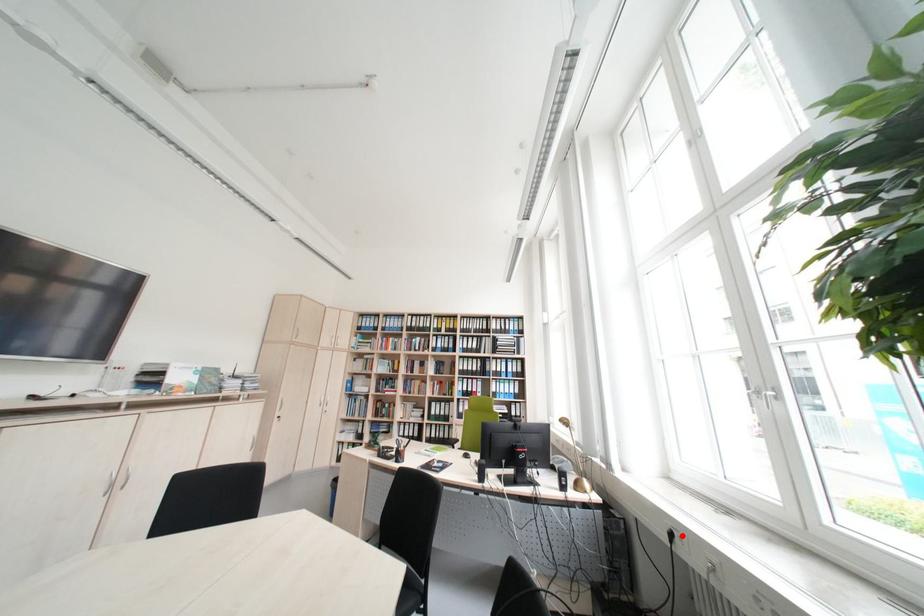
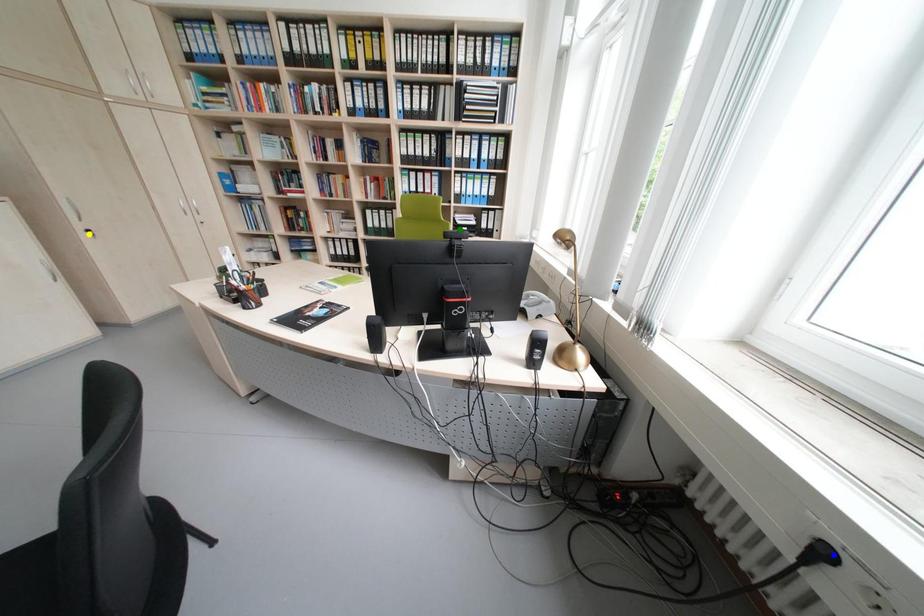
Question: I am providing you with two images of the same scene from different viewpoints. A red point is marked on the first image. You are given multiple points on the second image. Which mark in image 2 goes with the point in image 1?

Choices:
 (A) green point
 (B) yellow point
 (C) blue point

Answer: (C)